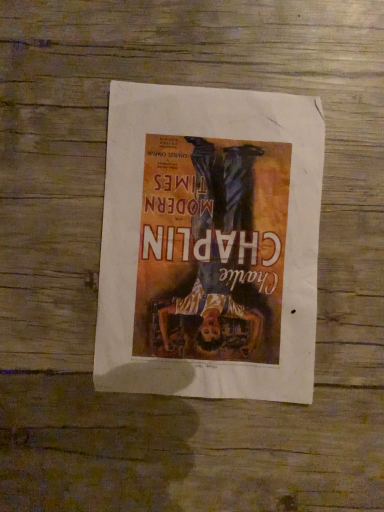
What do you see at coordinates (210, 243) in the screenshot? The width and height of the screenshot is (384, 512). I see `matte paper poster at center` at bounding box center [210, 243].

Where is `matte paper poster at center`? matte paper poster at center is located at coordinates (210, 243).

This screenshot has width=384, height=512. Identify the location of matte paper poster at center. 210,243.